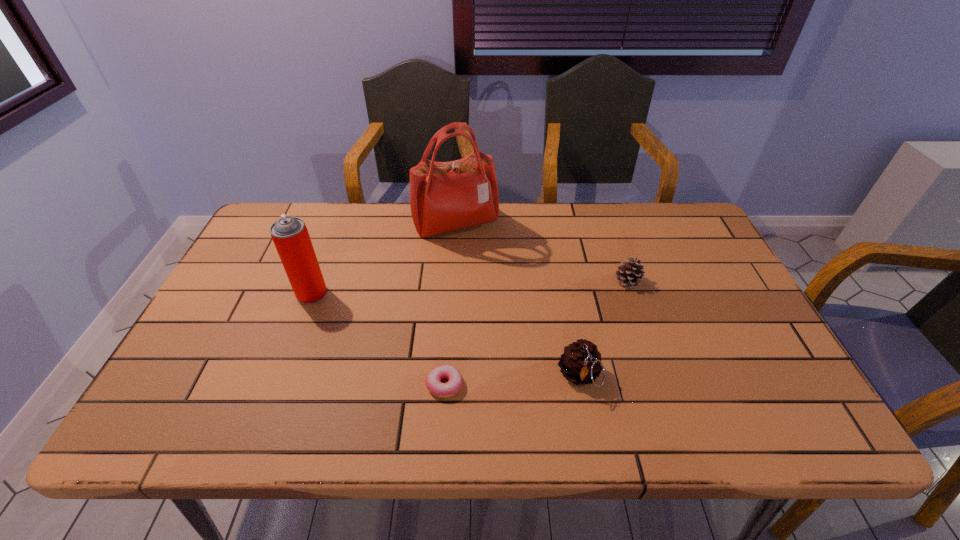
The height and width of the screenshot is (540, 960). Identify the location of handbag. (444, 196).

At what (x,y) coordinates should I click in order to perform the action: click on the tallest object. Please return your answer as a coordinate pair (x, y). Looking at the image, I should click on (444, 196).

Identify the location of the second tallest object. This screenshot has height=540, width=960. 290,235.

Where is `aerosol can`? The height and width of the screenshot is (540, 960). aerosol can is located at coordinates (290, 235).

Locate an element on the screen. The width and height of the screenshot is (960, 540). the third tallest object is located at coordinates (580, 363).

Locate an element on the screen. The height and width of the screenshot is (540, 960). the left pinecone is located at coordinates (580, 363).

You are a GUI agent. You are given a task and a screenshot of the screen. Output one action in this format:
    pyautogui.click(x=<x>, y=<y>)
    Task: Click on the fourth tallest object
    This screenshot has width=960, height=540.
    Given the screenshot: What is the action you would take?
    click(x=631, y=272)

Image resolution: width=960 pixels, height=540 pixels. I want to click on the shorter pinecone, so click(x=631, y=272).

Identify the location of the shortest object. The width and height of the screenshot is (960, 540). (433, 380).

Where is `free spot located 0.350m on the front-facing side of the farthest object`? This screenshot has height=540, width=960. free spot located 0.350m on the front-facing side of the farthest object is located at coordinates (449, 335).